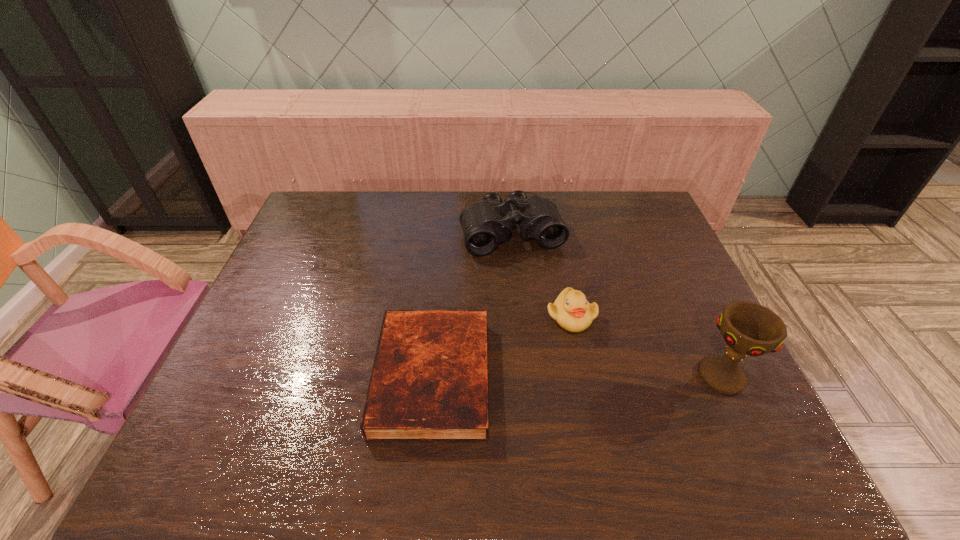
This screenshot has height=540, width=960. Find the location of `vacant area that lies between the second shortest object and the tallest object`. vacant area that lies between the second shortest object and the tallest object is located at coordinates (647, 346).

Locate an element on the screen. empty space between the third shortest object and the rightmost object is located at coordinates (617, 305).

Identify the location of vacant space in between the binoculars and the third tallest object. (541, 275).

You are a GUI agent. You are given a task and a screenshot of the screen. Output one action in this format:
    pyautogui.click(x=<x>, y=<y>)
    Task: Click on the free space between the tallest object and the Bible
    The height and width of the screenshot is (540, 960).
    Given the screenshot: What is the action you would take?
    point(577,376)

At what (x,y) coordinates should I click in order to perform the action: click on free spot between the farthest object and the tallest object. Please return your answer as a coordinate pair (x, y). Image resolution: width=960 pixels, height=540 pixels. Looking at the image, I should click on point(617,305).

Where is `vacant point located between the Bible and the second tallest object`? The width and height of the screenshot is (960, 540). vacant point located between the Bible and the second tallest object is located at coordinates (472, 305).

Identify which object is located as the nearest to the duckling. Please provide its 2D coordinates. Your answer should be formatted as a tuple, i.e. [(x, y)], where the tuple contains the x and y coordinates of a point satisfying the conditions above.

[(429, 382)]

Choose which object is the third nearest neighbor to the shortest object. Please provide its 2D coordinates. Your answer should be formatted as a tuple, i.e. [(x, y)], where the tuple contains the x and y coordinates of a point satisfying the conditions above.

[(748, 328)]